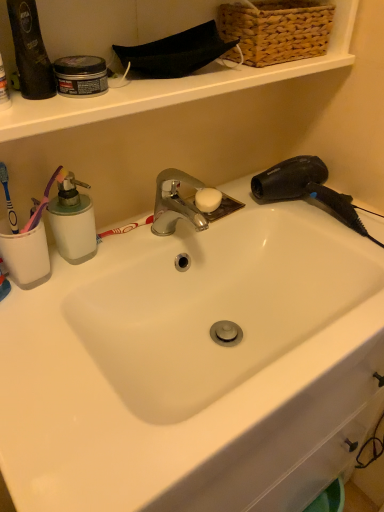
Find the location of a particular element. The width and height of the screenshot is (384, 512). blue plastic toothbrush at left is located at coordinates (8, 199).

Where is `black plastic hair dryer at upper right`? black plastic hair dryer at upper right is located at coordinates (306, 189).

Is black plastic hair dryer at upper right situated inside blue plastic toothbrush at left or outside?

black plastic hair dryer at upper right is spatially situated outside blue plastic toothbrush at left.

Which is closer, (314,185) or (11,223)?

Point (314,185).

In order to click on brush above the black plastic hair dryer at upper right (from a real-world perspective) in this screenshot , I will do `click(8, 199)`.

How distant is black plastic hair dryer at upper right from blue plastic toothbrush at left?

A distance of 56.57 centimeters exists between black plastic hair dryer at upper right and blue plastic toothbrush at left.

Between black plastic hair dryer at upper right and woven wicker basket at upper right, which one has smaller width?

woven wicker basket at upper right.

Which object is positioned more to the right, black plastic hair dryer at upper right or woven wicker basket at upper right?

Positioned to the right is black plastic hair dryer at upper right.

Does point (357, 216) come behind point (320, 9)?

Yes.

Between black plastic hair dryer at upper right and woven wicker basket at upper right, which one is positioned behind?

black plastic hair dryer at upper right is further from the camera.

Based on the photo, considering the sizes of white ceramic sink at center and black plastic hair dryer at upper right in the image, is white ceramic sink at center taller or shorter than black plastic hair dryer at upper right?

In the image, white ceramic sink at center appears to be taller than black plastic hair dryer at upper right.

Which is nearer, (190, 292) or (275, 170)?

Point (190, 292) appears to be closer to the viewer than point (275, 170).

Are white ceramic sink at center and black plastic hair dryer at upper right making contact?

No, white ceramic sink at center is not in contact with black plastic hair dryer at upper right.

Can you confirm if white ceramic sink at center is wider than black plastic hair dryer at upper right?

Indeed, white ceramic sink at center has a greater width compared to black plastic hair dryer at upper right.

Consider the image. Considering the sizes of blue plastic toothbrush at left and woven wicker basket at upper right in the image, is blue plastic toothbrush at left taller or shorter than woven wicker basket at upper right?

Considering their sizes, blue plastic toothbrush at left has more height than woven wicker basket at upper right.

From a real-world perspective, is blue plastic toothbrush at left located beneath woven wicker basket at upper right?

Yes, from a real-world perspective, blue plastic toothbrush at left is beneath woven wicker basket at upper right.

From the picture: Could you tell me if blue plastic toothbrush at left is facing woven wicker basket at upper right?

No, blue plastic toothbrush at left is not turned towards woven wicker basket at upper right.

Which is nearer, (x=0, y=162) or (x=258, y=10)?

Point (x=0, y=162) is closer to the camera than point (x=258, y=10).

Which of these two, woven wicker basket at upper right or white ceramic sink at center, is wider?

white ceramic sink at center.

Which is nearer, (250,39) or (213,505)?

Point (250,39) appears to be farther away from the viewer than point (213,505).

From a real-world perspective, between woven wicker basket at upper right and white ceramic sink at center, who is vertically higher?

woven wicker basket at upper right, from a real-world perspective.

Considering the relative sizes of woven wicker basket at upper right and white ceramic sink at center in the image provided, is woven wicker basket at upper right bigger than white ceramic sink at center?

Actually, woven wicker basket at upper right might be smaller than white ceramic sink at center.

Is there a large distance between white ceramic sink at center and woven wicker basket at upper right?

white ceramic sink at center is actually quite close to woven wicker basket at upper right.

Locate an element on the screen. Image resolution: width=384 pixels, height=512 pixels. basket lying behind the white ceramic sink at center is located at coordinates (277, 29).

Looking at this image, how many degrees apart are the facing directions of white ceramic sink at center and woven wicker basket at upper right?

The angular difference between white ceramic sink at center and woven wicker basket at upper right is 1.3 degrees.

Which is in front, blue plastic toothbrush at left or white plastic soap dispenser at left?

blue plastic toothbrush at left is more forward.

Is blue plastic toothbrush at left taller than white plastic soap dispenser at left?

Incorrect, the height of blue plastic toothbrush at left is not larger of that of white plastic soap dispenser at left.

Could you tell me if blue plastic toothbrush at left is turned towards white plastic soap dispenser at left?

No, blue plastic toothbrush at left is not oriented towards white plastic soap dispenser at left.

Find the location of `brush that is on the left side of black plastic hair dryer at upper right`. brush that is on the left side of black plastic hair dryer at upper right is located at coordinates (8, 199).

Identify the location of hair drier on the right of woven wicker basket at upper right. (306, 189).

From the image, which object appears to be farther from white plastic soap dispenser at left, blue plastic toothbrush at left or white ceramic sink at center?

white ceramic sink at center lies further to white plastic soap dispenser at left than the other object.

Considering their positions, is black plastic hair dryer at upper right positioned further to white ceramic sink at center than white plastic soap dispenser at left?

black plastic hair dryer at upper right lies further to white ceramic sink at center than the other object.

Looking at this image, estimate the real-world distances between objects in this image. Which object is closer to white ceramic sink at center, white plastic soap dispenser at left or woven wicker basket at upper right?

Based on the image, white plastic soap dispenser at left appears to be nearer to white ceramic sink at center.

Considering their positions, is white ceramic sink at center positioned further to woven wicker basket at upper right than white plastic soap dispenser at left?

white ceramic sink at center is positioned further to the anchor woven wicker basket at upper right.

Based on their spatial positions, is white plastic soap dispenser at left or black plastic hair dryer at upper right closer to white ceramic sink at center?

Based on the image, white plastic soap dispenser at left appears to be nearer to white ceramic sink at center.

Estimate the real-world distances between objects in this image. Which object is further from white plastic soap dispenser at left, white ceramic sink at center or woven wicker basket at upper right?

Among the two, woven wicker basket at upper right is located further to white plastic soap dispenser at left.

From the image, which object appears to be nearer to black plastic hair dryer at upper right, white plastic soap dispenser at left or woven wicker basket at upper right?

woven wicker basket at upper right lies closer to black plastic hair dryer at upper right than the other object.

Which object lies further to the anchor point woven wicker basket at upper right, blue plastic toothbrush at left or black plastic hair dryer at upper right?

Among the two, blue plastic toothbrush at left is located further to woven wicker basket at upper right.

You are a GUI agent. You are given a task and a screenshot of the screen. Output one action in this format:
    pyautogui.click(x=<x>, y=<y>)
    Task: Click on the soap dispenser between blue plastic toothbrush at left and white ceramic sink at center vertically
    
    Given the screenshot: What is the action you would take?
    pyautogui.click(x=73, y=221)

At what (x,y) coordinates should I click in order to perform the action: click on brush that lies between woven wicker basket at upper right and white ceramic sink at center from top to bottom. Please return your answer as a coordinate pair (x, y). Looking at the image, I should click on pos(8,199).

Locate an element on the screen. The width and height of the screenshot is (384, 512). soap dispenser between woven wicker basket at upper right and white ceramic sink at center vertically is located at coordinates (73, 221).

This screenshot has height=512, width=384. What are the coordinates of `hair drier between woven wicker basket at upper right and white ceramic sink at center from top to bottom` in the screenshot? It's located at (306, 189).